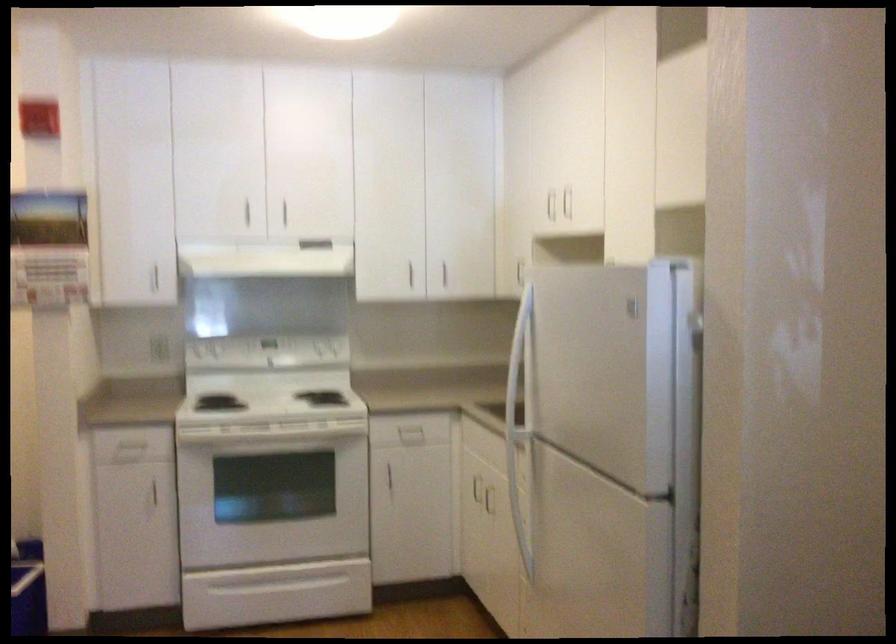
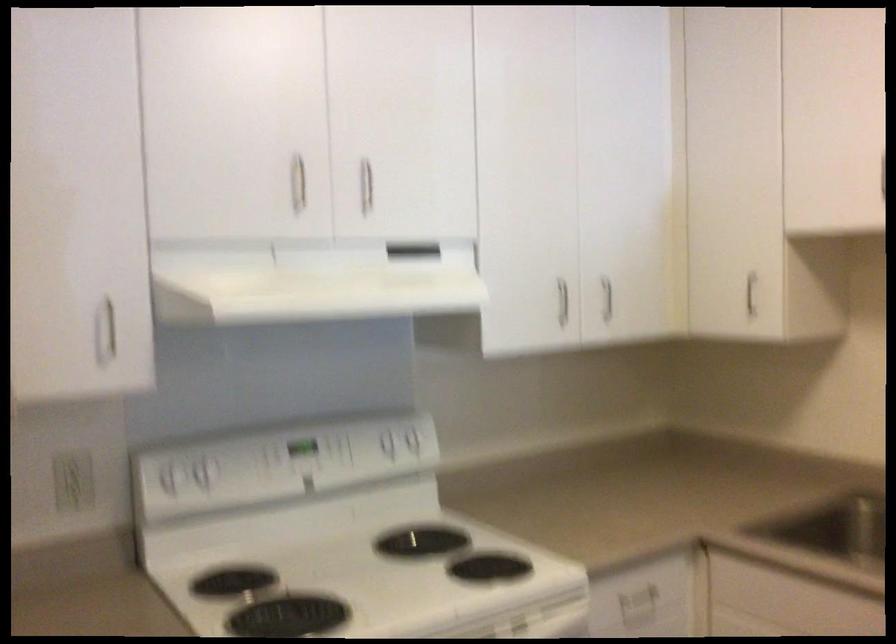
Locate, in the second image, the point that corresponds to point 315,343 in the first image.

(385, 440)